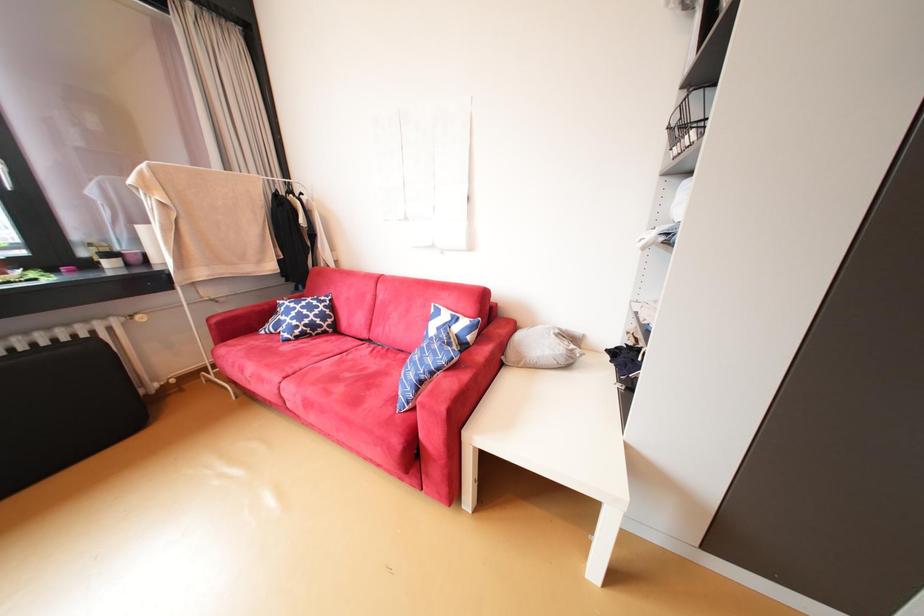
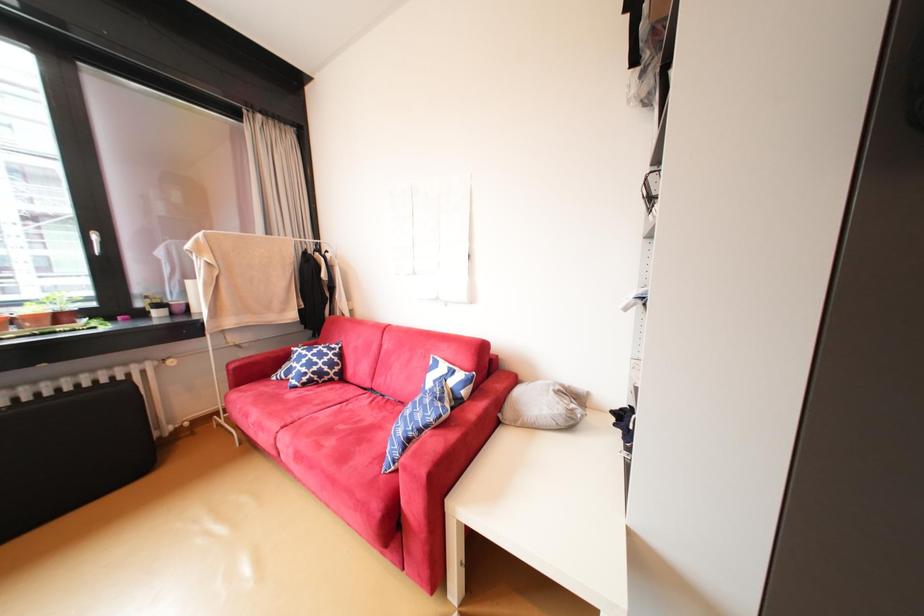
Question: What movement of the cameraman would produce the second image?

Choices:
 (A) Left
 (B) Right
 (C) Forward
 (D) Backward

Answer: (B)